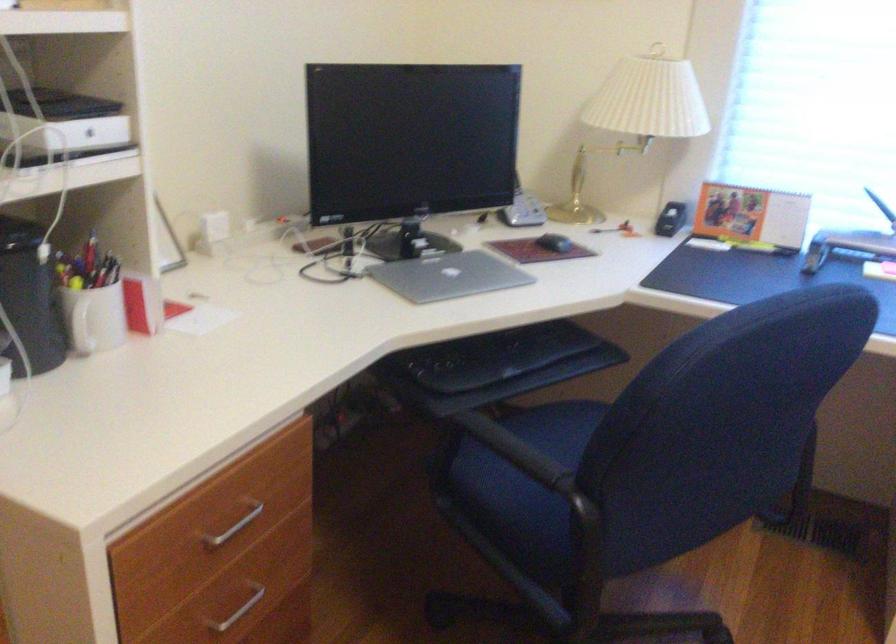
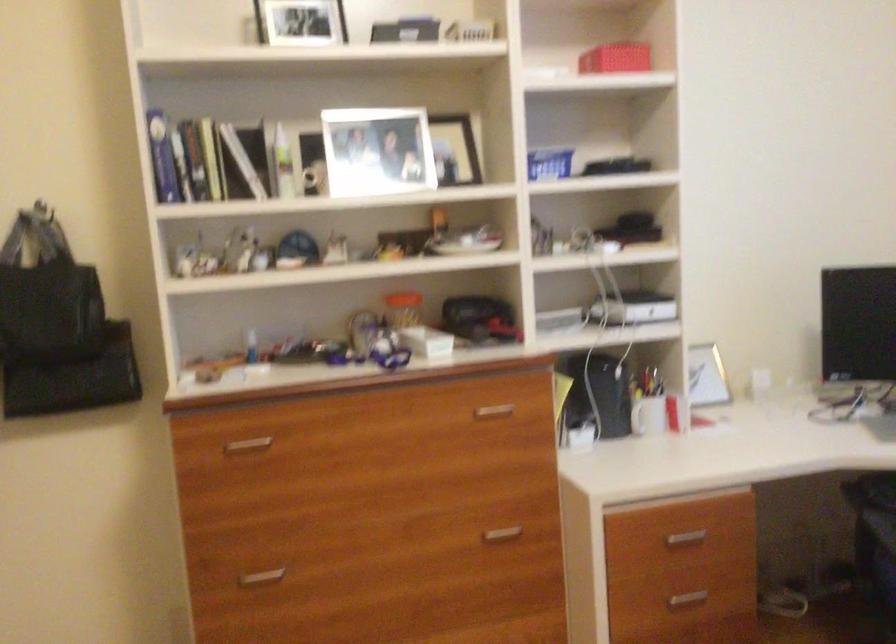
Locate, in the second image, the point that corresponds to the point at 218,526 in the first image.

(685, 538)